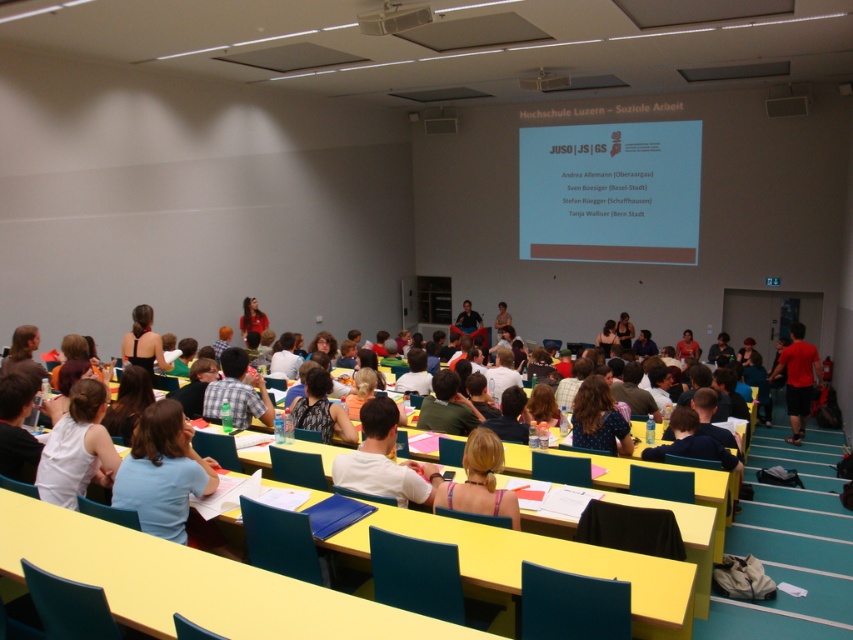
Question: Which is nearer to the matte green bottle at center?

Choices:
 (A) white fabric shirt at center
 (B) matte red shirt at center
 (C) blue dotted shirt at center

Answer: (A)

Question: Is white fabric shirt at lower left positioned behind blonde hair at center?

Choices:
 (A) no
 (B) yes

Answer: (B)

Question: From the image, what is the correct spatial relationship of blonde hair at center in relation to red cotton t-shirt at right?

Choices:
 (A) left
 (B) right

Answer: (A)

Question: Can you confirm if light blue fabric shirt at center is positioned to the right of matte red shirt at center?

Choices:
 (A) yes
 (B) no

Answer: (A)

Question: Estimate the real-world distances between objects in this image. Which object is closer to the white plastic projector at upper center?

Choices:
 (A) red cotton t-shirt at right
 (B) light blue fabric shirt at center
 (C) blonde hair at center
 (D) white fabric shirt at center

Answer: (D)

Question: Which point is farther from the camera taking this photo?

Choices:
 (A) (250, 300)
 (B) (619, 419)
 (C) (149, 348)
 (D) (247, 413)

Answer: (A)